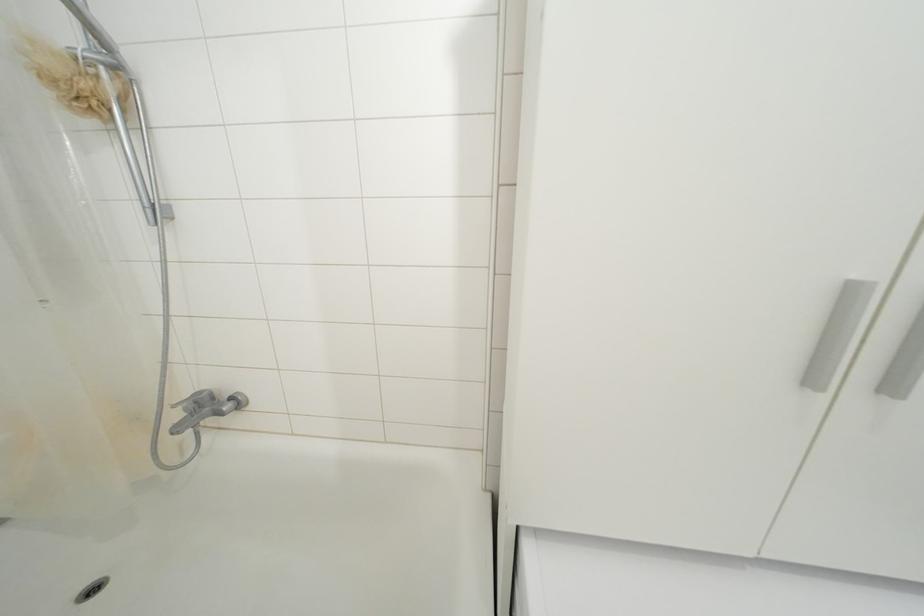
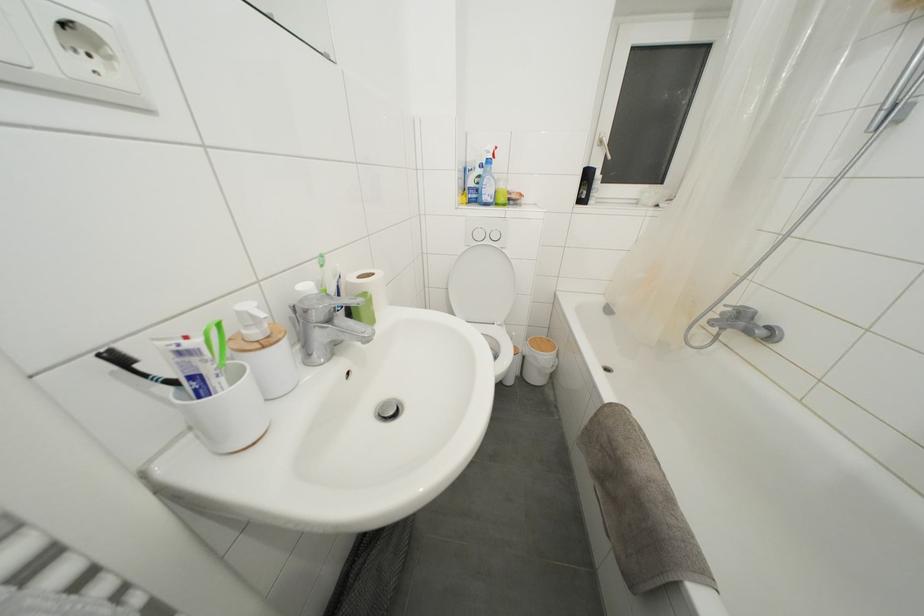
The point at (188, 415) is marked in the first image. Where is the corresponding point in the second image?

(726, 318)